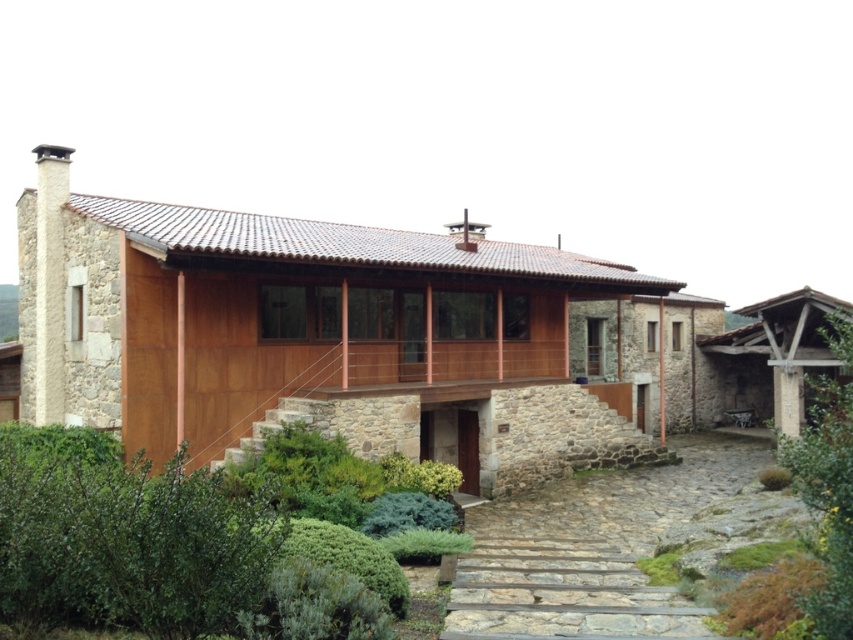
Is point (358, 605) less distant than point (672, 627)?

Yes, it is.

Between green leafy hedge at center and gray stone steps at center, which one is positioned higher?

green leafy hedge at center

Is point (321, 627) closer to camera compared to point (641, 625)?

Yes, point (321, 627) is closer to viewer.

Locate an element on the screen. green leafy hedge at center is located at coordinates (155, 548).